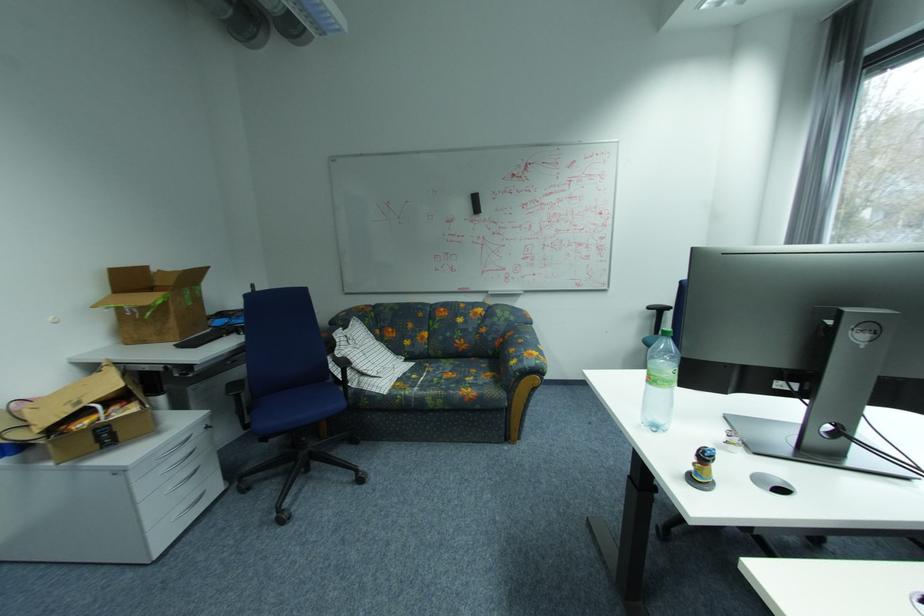
Image resolution: width=924 pixels, height=616 pixels. In order to click on floral sofa armrest in this screenshot , I will do `click(526, 352)`.